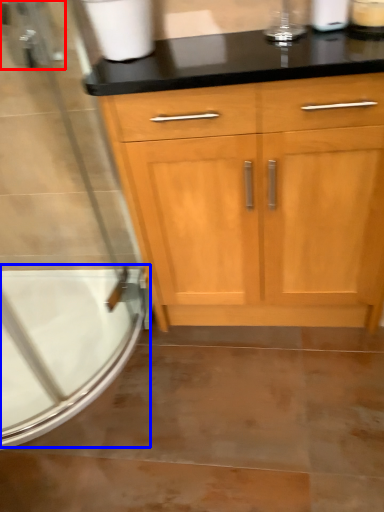
Question: Which of the following is the farthest to the observer, faucet (highlighted by a red box) or bath (highlighted by a blue box)?

Choices:
 (A) faucet
 (B) bath

Answer: (B)